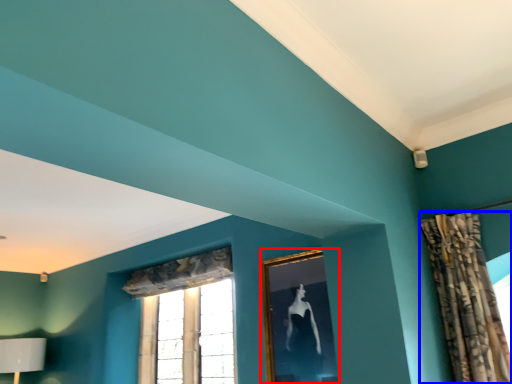
Question: Which object appears farthest to the camera in this image, picture frame (highlighted by a red box) or curtain (highlighted by a blue box)?

Choices:
 (A) picture frame
 (B) curtain

Answer: (A)